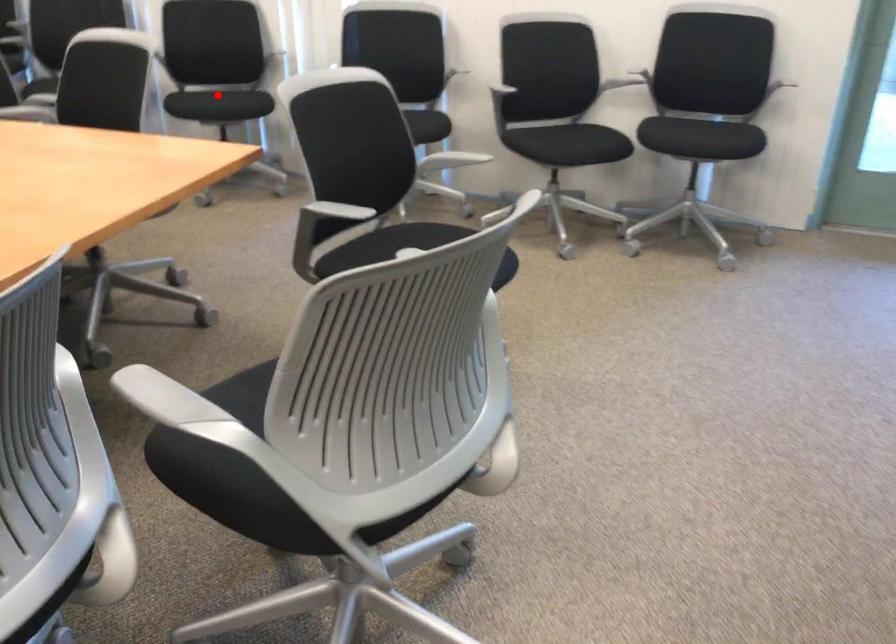
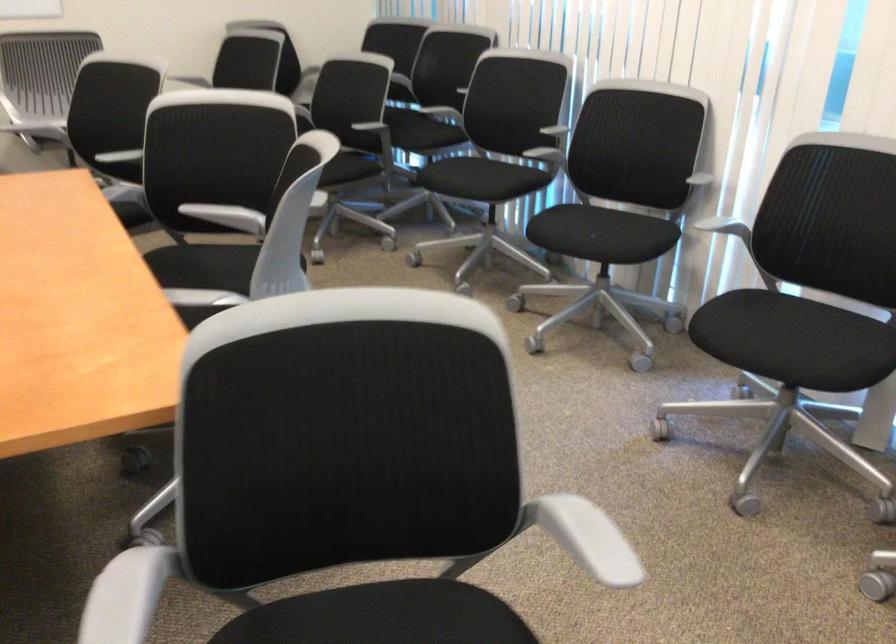
Find the pixel in the second image that matches the highlighted location in the first image.

(582, 232)